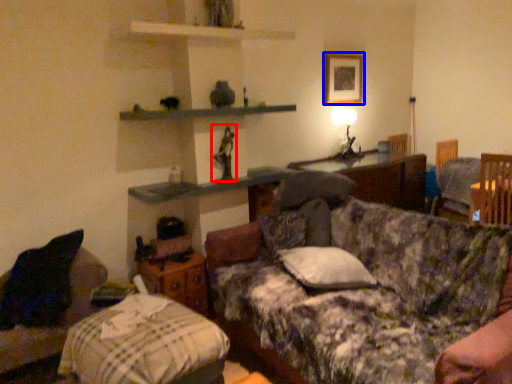
Question: Among these objects, which one is farthest to the camera, toy (highlighted by a red box) or picture frame (highlighted by a blue box)?

Choices:
 (A) toy
 (B) picture frame

Answer: (B)